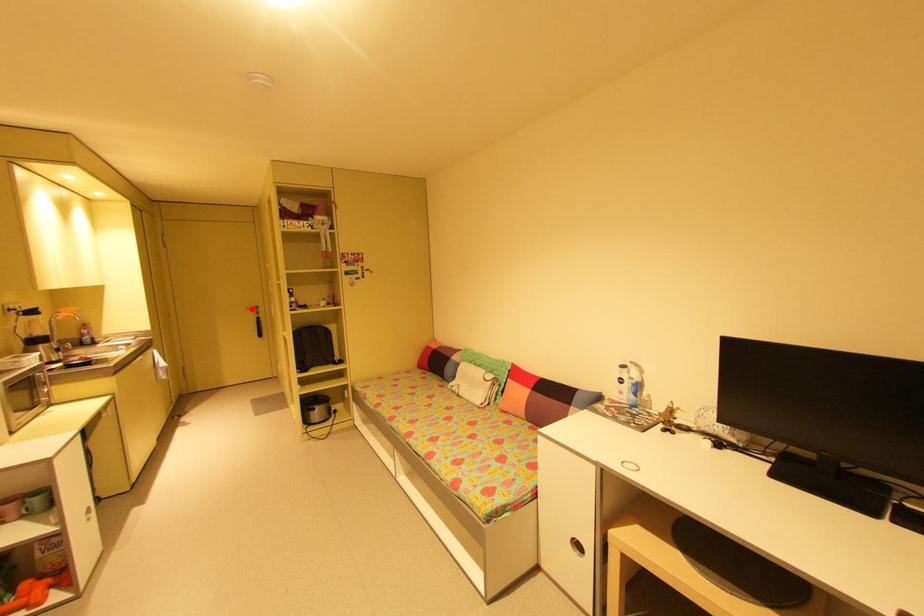
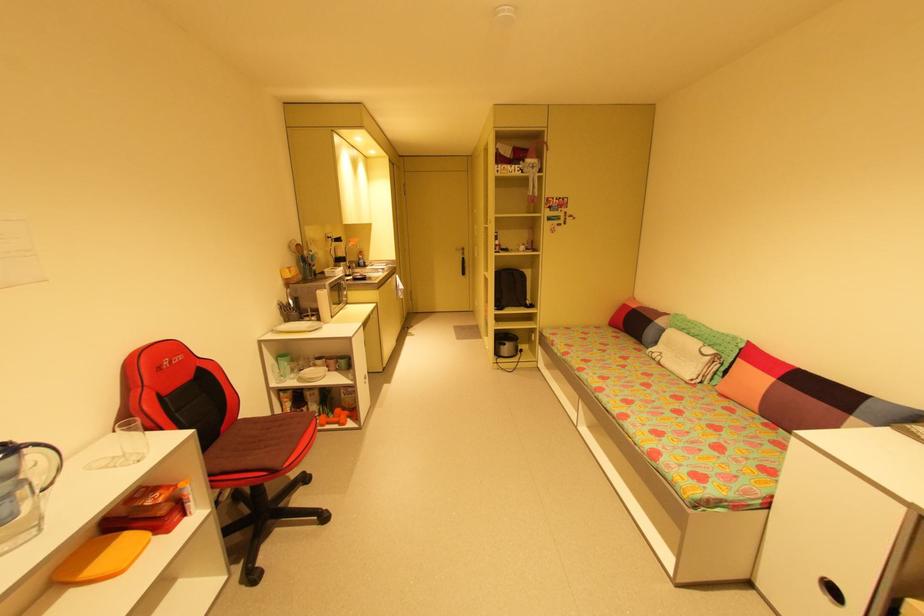
Question: I am providing you with two images of the same scene from different viewpoints. In image1, a red point is highlighted. Considering the same 3D point in image2, which of the following is correct?

Choices:
 (A) It is closer
 (B) It is farther

Answer: (A)